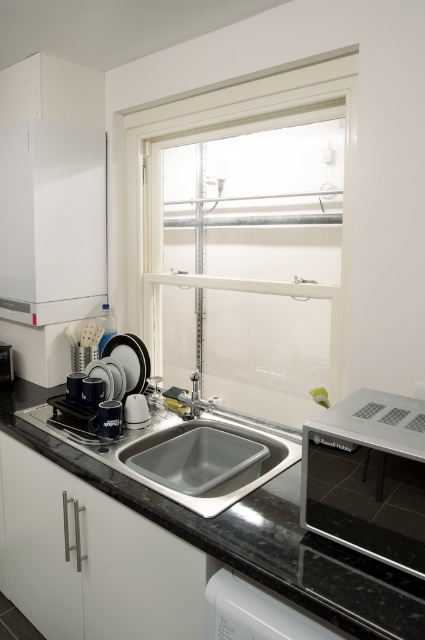
Question: Can you confirm if black granite countertop at center is positioned below brushed metal toaster at lower left?

Choices:
 (A) yes
 (B) no

Answer: (A)

Question: Which object is farther from the camera taking this photo?

Choices:
 (A) white matte cabinet at left
 (B) satin nickel faucet at sink center

Answer: (A)

Question: Which object is farther from the camera taking this photo?

Choices:
 (A) white matte cabinet at left
 (B) white glass window at center

Answer: (B)

Question: Can you confirm if white glass window at center is thinner than white glossy dishwasher at lower center?

Choices:
 (A) no
 (B) yes

Answer: (A)

Question: Estimate the real-world distances between objects in this image. Which object is farther from the black granite countertop at center?

Choices:
 (A) white glossy dishwasher at lower center
 (B) sleek silver microwave at center
 (C) gray matte sink at center
 (D) brushed metal toaster at lower left

Answer: (D)

Question: Observing the image, what is the correct spatial positioning of white glass window at center in reference to brushed metal toaster at lower left?

Choices:
 (A) left
 (B) right

Answer: (B)